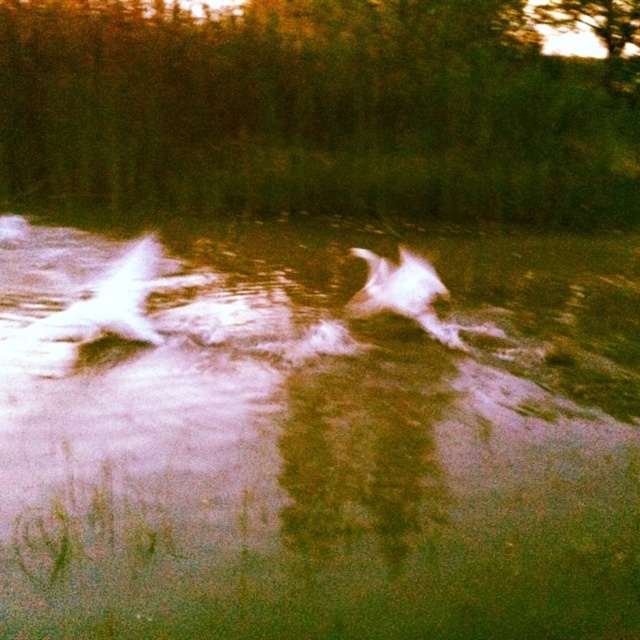
Does white frothy water at center appear on the right side of white fluffy dog at center?

Incorrect, white frothy water at center is not on the right side of white fluffy dog at center.

Identify the location of white frothy water at center. The height and width of the screenshot is (640, 640). (314, 438).

Where is `white frothy water at center`? The height and width of the screenshot is (640, 640). white frothy water at center is located at coordinates (314, 438).